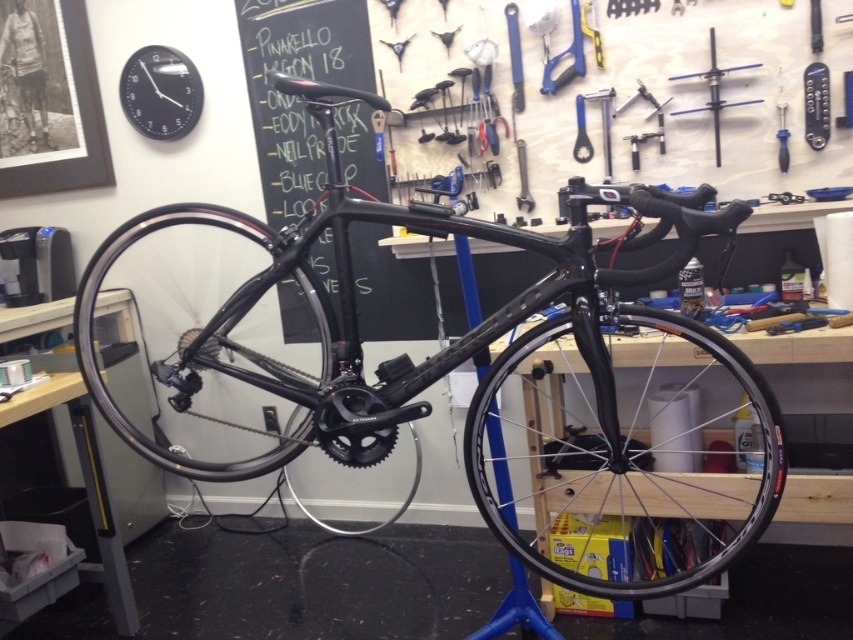
Consider the image. Can you confirm if black carbon fiber wheel at center is positioned above blue metallic screwdriver at upper center?

No, black carbon fiber wheel at center is not above blue metallic screwdriver at upper center.

Is black carbon fiber wheel at center shorter than blue metallic screwdriver at upper center?

No.

Locate an element on the screen. This screenshot has width=853, height=640. black carbon fiber wheel at center is located at coordinates 625,454.

Measure the distance between glossy carbon fiber bicycle at center and metallic silver wrench at upper right.

They are 1.11 meters apart.

You are a GUI agent. You are given a task and a screenshot of the screen. Output one action in this format:
    pyautogui.click(x=<x>, y=<y>)
    Task: Click on the glossy carbon fiber bicycle at center
    The height and width of the screenshot is (640, 853).
    Given the screenshot: What is the action you would take?
    pyautogui.click(x=492, y=372)

Is black matte chalkboard at center taller than metallic silver wrench at upper right?

Yes.

What do you see at coordinates (294, 99) in the screenshot?
I see `black matte chalkboard at center` at bounding box center [294, 99].

You are a GUI agent. You are given a task and a screenshot of the screen. Output one action in this format:
    pyautogui.click(x=<x>, y=<y>)
    Task: Click on the black matte chalkboard at center
    The height and width of the screenshot is (640, 853).
    Given the screenshot: What is the action you would take?
    pyautogui.click(x=294, y=99)